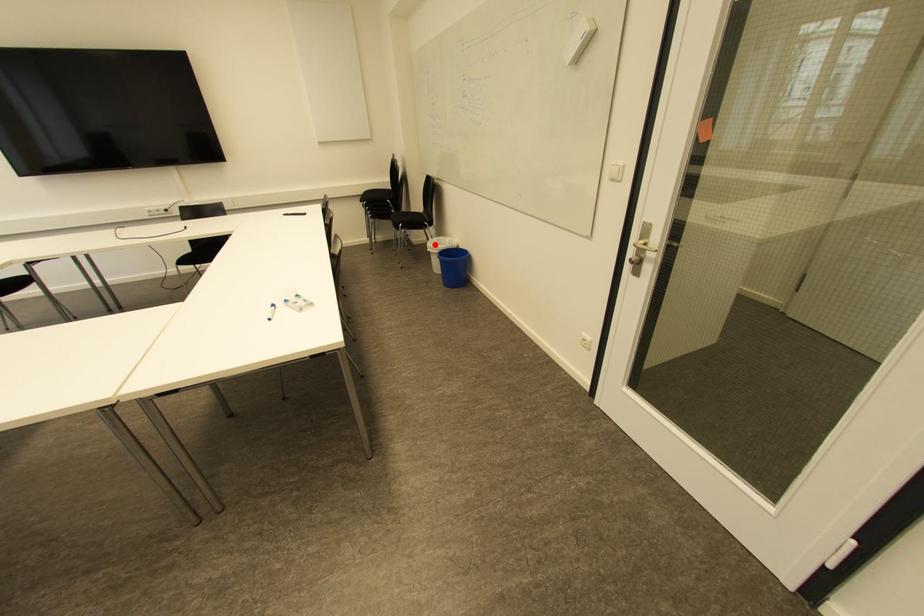
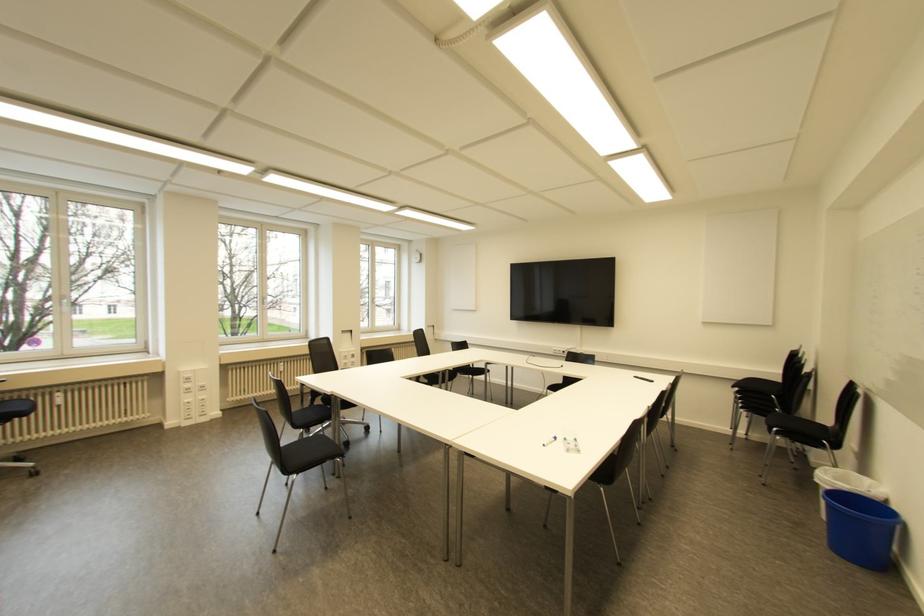
The point at the highlighted location is marked in the first image. Where is the corresponding point in the second image?

(829, 477)